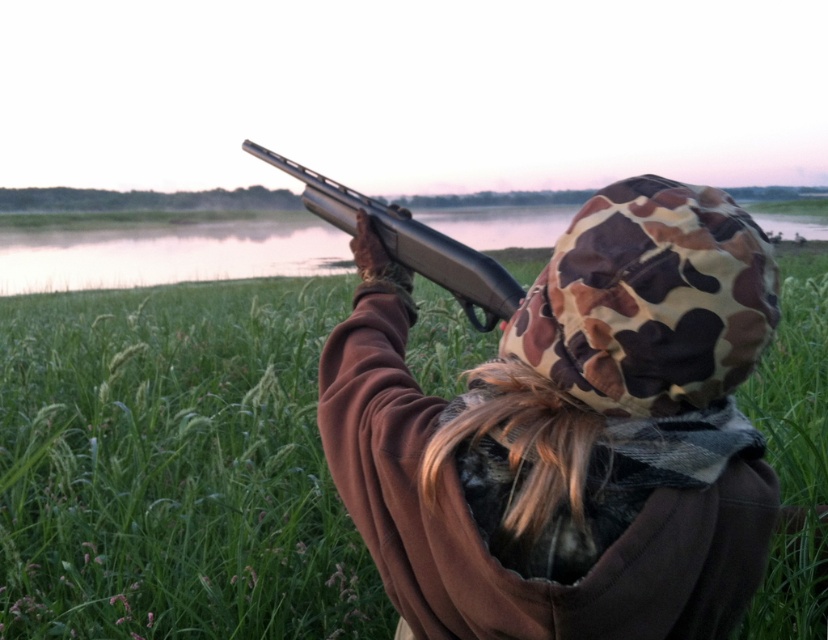
You are a drone operator trying to locate a specific point in the image. The point you need to find is at coordinates point (570,433). According to the scene description, where exactly is this point located?

The point (570,433) is located on the brown matte jacket at upper center.

Consider the image. You are a wildlife photographer trying to capture a clear shot of the birds in the sky. You notice the brown matte jacket at upper center and the matte black shotgun at upper center in your viewfinder. Which object is positioned higher in the frame?

The brown matte jacket at upper center is taller than the matte black shotgun at upper center, so the brown matte jacket at upper center is positioned higher in the frame.

You are a game warden assessing a hunter in a field. You notice the brown matte jacket at upper center and the matte black shotgun at upper center. Which object is positioned higher in the image?

The matte black shotgun at upper center is positioned higher than the brown matte jacket at upper center in the image.